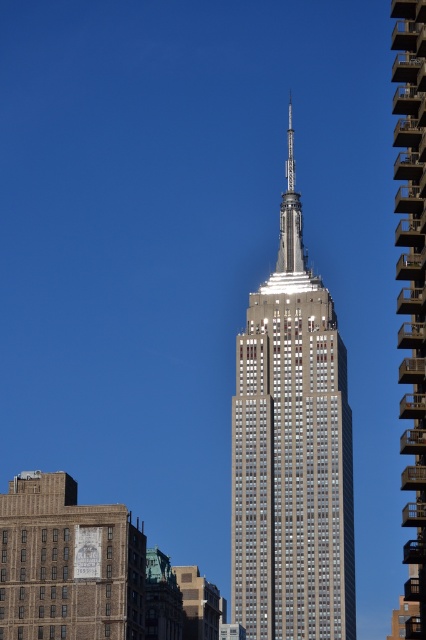
You are an architect analyzing the skyline of a city. You observe the silver metallic building at center and the glassy steel building at center. Which building has a narrower width?

The silver metallic building at center has a narrower width than the glassy steel building at center according to the description provided.

You are standing at the center of the image and want to locate the silver metallic building at center. According to the coordinates provided, in which direction should you look to find it?

The silver metallic building at center is located at coordinates point (x=291, y=452), so you should look to the lower right direction from the center of the image to find it.

You are standing in front of the Empire State Building and want to take a photo that includes both the Empire State Building and the shorter brown building to its left. You notice two points marked on your camera screen at coordinates point (x=293, y=464) and point (x=420, y=435). Which point is closer to you when focusing on the Empire State Building?

Point (x=293, y=464) is further to the camera than point (x=420, y=435), so the point closer to you is point (x=420, y=435).